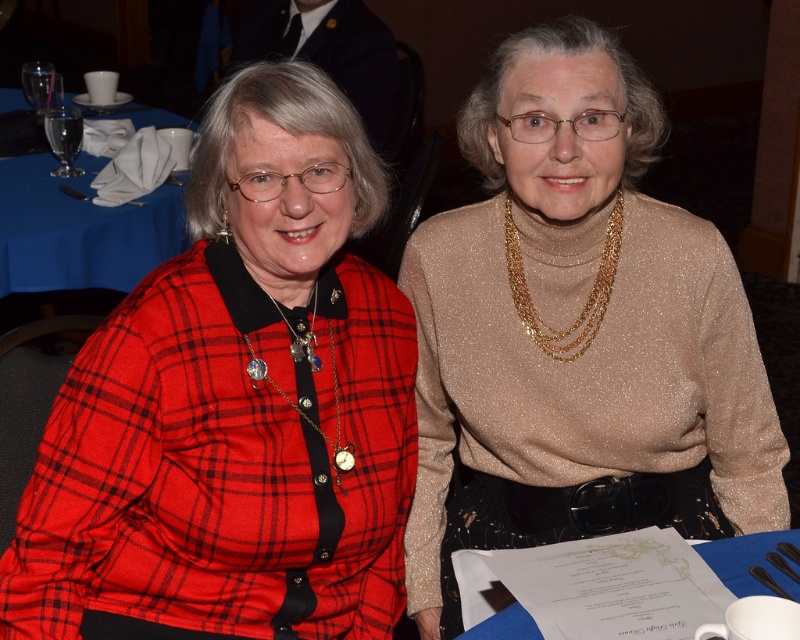
From the picture: Which of these two, blue paper at lower right or silver metallic chain with pendants at center, stands shorter?

With less height is blue paper at lower right.

What do you see at coordinates (748, 561) in the screenshot? I see `blue paper at lower right` at bounding box center [748, 561].

Is point (506, 628) positioned before point (260, 358)?

Yes, it is.

Locate an element on the screen. The width and height of the screenshot is (800, 640). blue paper at lower right is located at coordinates (748, 561).

Does gold glitter sweater at center have a greater width compared to blue cloth napkin at left?

Yes, gold glitter sweater at center is wider than blue cloth napkin at left.

Is gold glitter sweater at center closer to the viewer compared to blue cloth napkin at left?

Yes, it is.

Between point (608, 76) and point (38, 241), which one is positioned behind?

Positioned behind is point (38, 241).

Identify the location of gold glitter sweater at center. (578, 332).

Which is in front, point (704, 248) or point (740, 582)?

Point (740, 582) is more forward.

The width and height of the screenshot is (800, 640). In order to click on gold glitter sweater at center in this screenshot , I will do `click(578, 332)`.